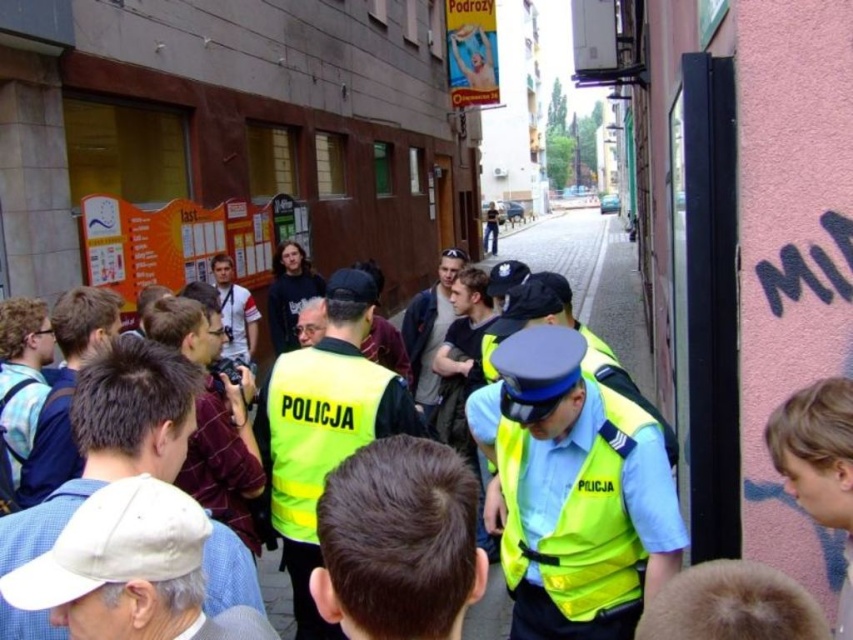
Question: Is neon yellow reflective vest at center to the right of yellow reflective vests at center from the viewer's perspective?

Choices:
 (A) yes
 (B) no

Answer: (B)

Question: Which object is farther from the camera taking this photo?

Choices:
 (A) neon yellow reflective vest at center
 (B) yellow reflective vests at center

Answer: (B)

Question: Which point is closer to the camera?

Choices:
 (A) yellow reflective vests at center
 (B) neon yellow reflective vest at center

Answer: (B)

Question: Can you confirm if neon yellow reflective vest at center is thinner than yellow reflective vests at center?

Choices:
 (A) yes
 (B) no

Answer: (B)

Question: Can you confirm if neon yellow reflective vest at center is positioned below yellow reflective vests at center?

Choices:
 (A) no
 (B) yes

Answer: (A)

Question: Which of the following is the farthest from the observer?

Choices:
 (A) (590, 420)
 (B) (482, 403)

Answer: (B)